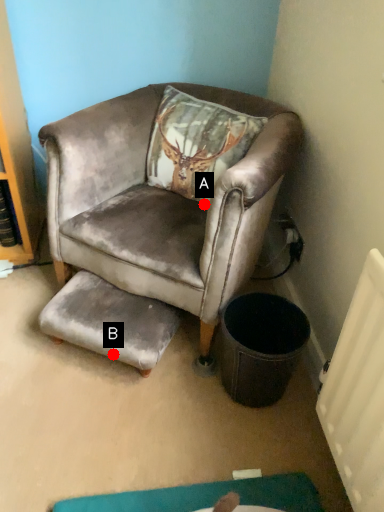
Question: Two points are circled on the image, labeled by A and B beside each circle. Which point appears closest to the camera in this image?

Choices:
 (A) A is closer
 (B) B is closer

Answer: (B)